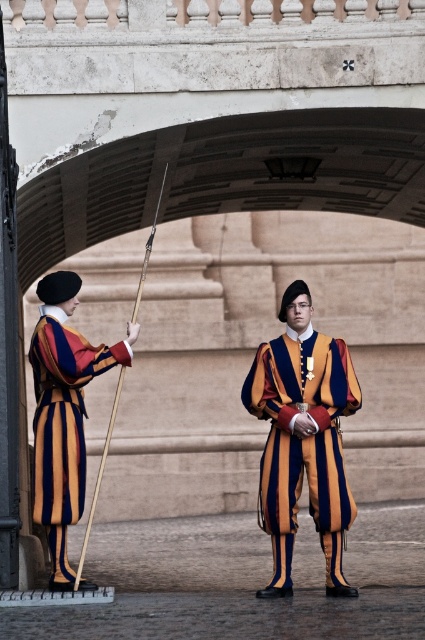
Consider the image. You are a photographer planning to take a group photo of the velvet striped uniform at center and the matte striped uniform at left. Which uniform should be positioned closer to the camera to ensure both are visible in the photo?

The velvet striped uniform at center should be positioned closer to the camera since the matte striped uniform at left is behind it, ensuring both are visible.

Based on the photo, you are an observer looking at two individuals under a stone archway. You notice the velvet striped uniform at center and the matte striped uniform at left. Which uniform has a narrower width?

The velvet striped uniform at center has a narrower width than the matte striped uniform at left.